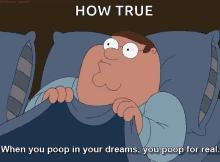
Identify the location of pillow case. The height and width of the screenshot is (162, 220). (187, 84).